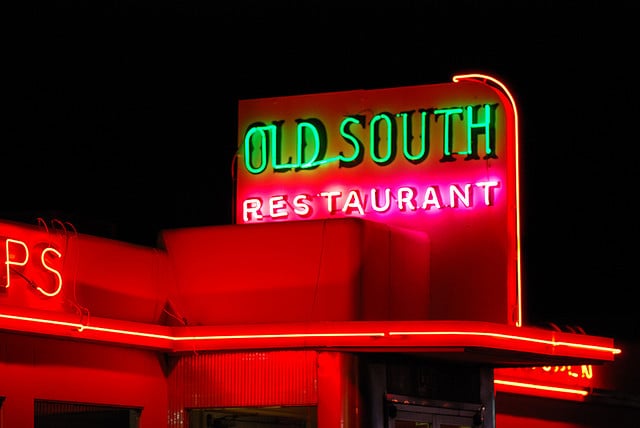
I want to click on neon light above doorway, so click(588, 347), click(524, 339).